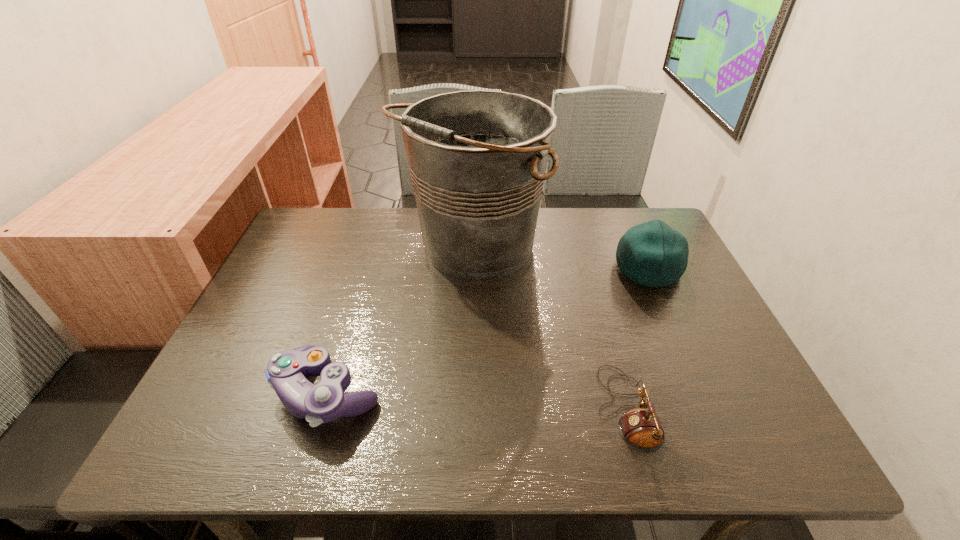
Locate an element on the screen. vacant region at the far edge of the desktop is located at coordinates (348, 242).

This screenshot has width=960, height=540. What are the coordinates of `vacant space at the near edge` in the screenshot? It's located at (457, 428).

Image resolution: width=960 pixels, height=540 pixels. In the image, there is a desktop. Find the location of `free space at the left edge`. free space at the left edge is located at coordinates (260, 341).

Identify the location of vacant region at the right edge of the desktop. (751, 399).

In the image, there is a desktop. Identify the location of vacant space at the far left corner. Image resolution: width=960 pixels, height=540 pixels. tap(324, 232).

Where is `vacant area between the telephone and the bucket`? The image size is (960, 540). vacant area between the telephone and the bucket is located at coordinates (549, 329).

Identify the location of free space between the second object from right to left and the rightmost object. (637, 339).

Where is `empty location between the tallest object and the second shortest object`? empty location between the tallest object and the second shortest object is located at coordinates (400, 321).

Image resolution: width=960 pixels, height=540 pixels. I want to click on vacant area between the control and the third shortest object, so click(489, 330).

In order to click on vacant area between the control and the tallest object in this screenshot , I will do `click(400, 321)`.